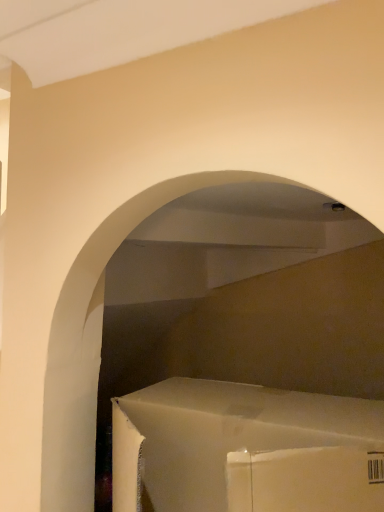
Question: Should I look upward or downward to see white cardboard box at lower center?

Choices:
 (A) up
 (B) down

Answer: (B)